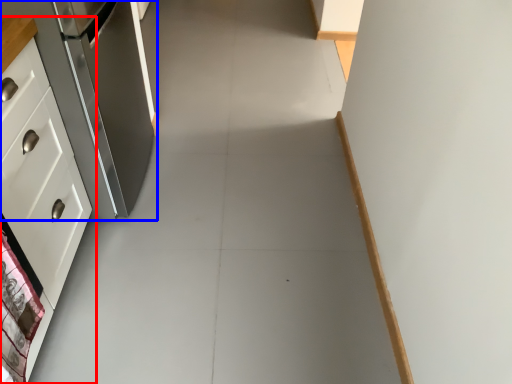
Question: Among these objects, which one is nearest to the camera, cabinetry (highlighted by a red box) or refrigerator (highlighted by a blue box)?

Choices:
 (A) cabinetry
 (B) refrigerator

Answer: (A)